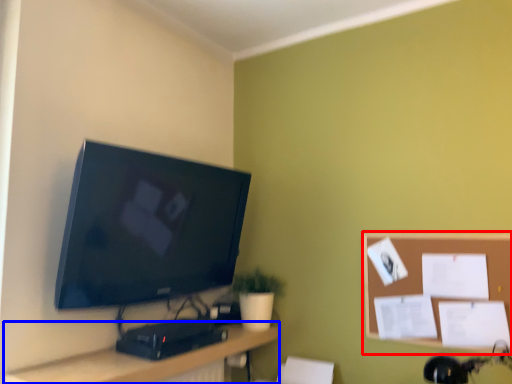
Question: Which object is further to the camera taking this photo, bulletin board (highlighted by a red box) or desk (highlighted by a blue box)?

Choices:
 (A) bulletin board
 (B) desk

Answer: (A)